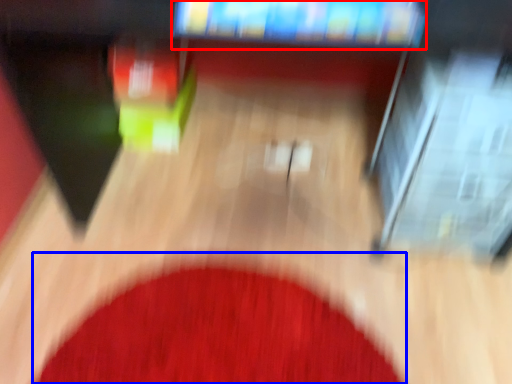
Question: Which object is closer to the camera taking this photo, television (highlighted by a red box) or mat (highlighted by a blue box)?

Choices:
 (A) television
 (B) mat

Answer: (A)